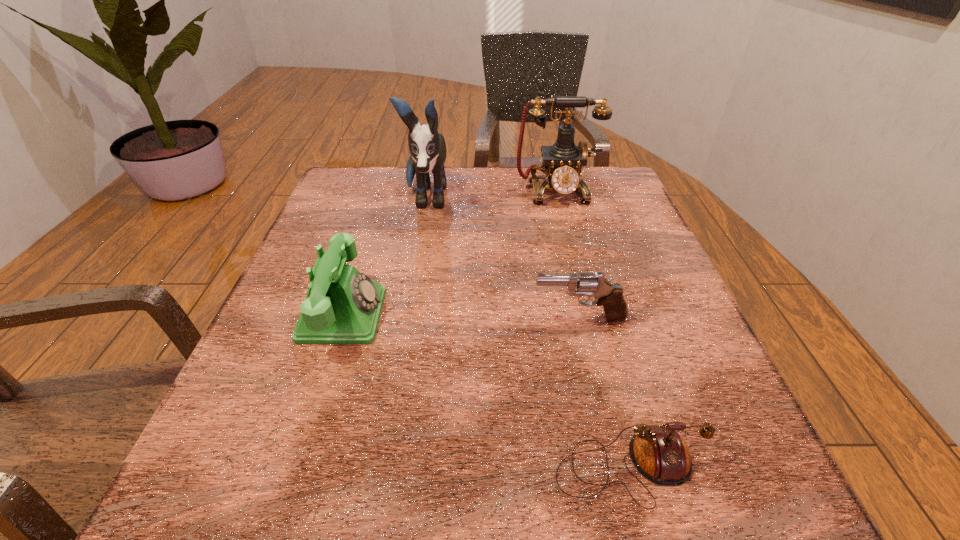
At what (x,y) coordinates should I click in order to perform the action: click on object that is at the near right corner. Please return your answer as a coordinate pair (x, y). This screenshot has height=540, width=960. Looking at the image, I should click on (658, 452).

Locate an element on the screen. The height and width of the screenshot is (540, 960). blank space at the far edge of the desktop is located at coordinates (532, 214).

The image size is (960, 540). I want to click on vacant space at the near edge of the desktop, so click(318, 471).

You are a GUI agent. You are given a task and a screenshot of the screen. Output one action in this format:
    pyautogui.click(x=<x>, y=<y>)
    Task: Click on the free location at the left edge
    
    Given the screenshot: What is the action you would take?
    pyautogui.click(x=334, y=399)

This screenshot has height=540, width=960. Find the location of `free space at the right edge of the desktop`. free space at the right edge of the desktop is located at coordinates (633, 301).

You are a GUI agent. You are given a task and a screenshot of the screen. Output one action in this format:
    pyautogui.click(x=<x>, y=<y>)
    Task: Click on the free region at the near left corner
    The image size is (960, 540).
    Given the screenshot: What is the action you would take?
    pyautogui.click(x=179, y=505)

The height and width of the screenshot is (540, 960). Identify the location of vacant space at the near right corner of the desktop. (742, 504).

I want to click on free space that is in between the second shortest object and the puppy, so click(503, 259).

Where is `vacant space that's between the puppy and the pistol`? This screenshot has width=960, height=540. vacant space that's between the puppy and the pistol is located at coordinates (503, 259).

Find the location of a particular element. Image resolution: width=960 pixels, height=540 pixels. empty location between the shortest telephone and the puppy is located at coordinates (527, 333).